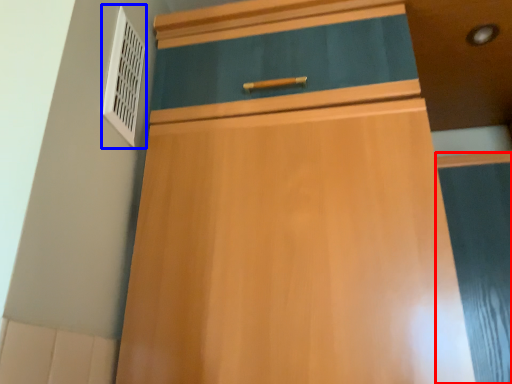
Question: Which point is further to the camera, screen door (highlighted by a red box) or air conditioning (highlighted by a blue box)?

Choices:
 (A) screen door
 (B) air conditioning

Answer: (B)